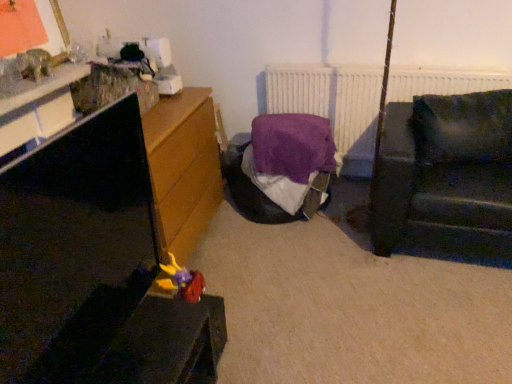
Consider the image. What is the approximate width of matt black tv stand at left?

matt black tv stand at left is 2.69 inches in width.

What do you see at coordinates (106, 254) in the screenshot?
I see `matt black tv stand at left` at bounding box center [106, 254].

Image resolution: width=512 pixels, height=384 pixels. Describe the element at coordinates (331, 100) in the screenshot. I see `white matte radiator at upper center` at that location.

The height and width of the screenshot is (384, 512). What do you see at coordinates (283, 168) in the screenshot?
I see `purple fabric bed at center` at bounding box center [283, 168].

The image size is (512, 384). I want to click on dark green fabric couch at right, so click(x=445, y=174).

Based on the photo, between plush yellow and purple toy at lower left and white matte radiator at upper center, which one has more height?

Standing taller between the two is white matte radiator at upper center.

Is plush yellow and purple toy at lower left not inside white matte radiator at upper center?

Indeed, plush yellow and purple toy at lower left is completely outside white matte radiator at upper center.

Is plush yellow and purple toy at lower left thinner than white matte radiator at upper center?

Incorrect, the width of plush yellow and purple toy at lower left is not less than that of white matte radiator at upper center.

Considering the positions of objects plush yellow and purple toy at lower left and white matte radiator at upper center in the image provided, who is more to the left, plush yellow and purple toy at lower left or white matte radiator at upper center?

From the viewer's perspective, plush yellow and purple toy at lower left appears more on the left side.

From the image's perspective, is matt black tv stand at left located above or below dark green fabric couch at right?

From the image's perspective, matt black tv stand at left appears below dark green fabric couch at right.

Can you confirm if matt black tv stand at left is positioned to the left of dark green fabric couch at right?

Indeed, matt black tv stand at left is positioned on the left side of dark green fabric couch at right.

Which of these two, matt black tv stand at left or dark green fabric couch at right, is thinner?

matt black tv stand at left is thinner.

Is matt black tv stand at left situated inside dark green fabric couch at right or outside?

matt black tv stand at left is located beyond the bounds of dark green fabric couch at right.

Which point is more distant from viewer, (186, 278) or (253, 173)?

The point (253, 173) is more distant.

From a real-world perspective, is plush yellow and purple toy at lower left physically located above or below purple fabric bed at center?

From a real-world perspective, plush yellow and purple toy at lower left is physically above purple fabric bed at center.

Which of these two, plush yellow and purple toy at lower left or purple fabric bed at center, is wider?

purple fabric bed at center is wider.

From their relative heights in the image, would you say matt black tv stand at left is taller or shorter than plush yellow and purple toy at lower left?

matt black tv stand at left is taller than plush yellow and purple toy at lower left.

Is matt black tv stand at left positioned with its back to plush yellow and purple toy at lower left?

No, matt black tv stand at left's orientation is not away from plush yellow and purple toy at lower left.

Which is behind, matt black tv stand at left or plush yellow and purple toy at lower left?

plush yellow and purple toy at lower left is behind.

What's the angular difference between matt black tv stand at left and plush yellow and purple toy at lower left's facing directions?

There is a 1.14-degree angle between the facing directions of matt black tv stand at left and plush yellow and purple toy at lower left.

Considering their positions, is white matte radiator at upper center located in front of or behind plush yellow and purple toy at lower left?

white matte radiator at upper center is positioned farther from the viewer than plush yellow and purple toy at lower left.

Is white matte radiator at upper center oriented away from plush yellow and purple toy at lower left?

No, white matte radiator at upper center is not facing away from plush yellow and purple toy at lower left.

Does white matte radiator at upper center touch plush yellow and purple toy at lower left?

No, white matte radiator at upper center is not beside plush yellow and purple toy at lower left.

From the image's perspective, which is above, white matte radiator at upper center or plush yellow and purple toy at lower left?

white matte radiator at upper center.

From a real-world perspective, relative to dark green fabric couch at right, is plush yellow and purple toy at lower left vertically above or below?

plush yellow and purple toy at lower left is below dark green fabric couch at right.

Is plush yellow and purple toy at lower left inside the boundaries of dark green fabric couch at right, or outside?

plush yellow and purple toy at lower left is not enclosed by dark green fabric couch at right.

Is plush yellow and purple toy at lower left taller or shorter than dark green fabric couch at right?

plush yellow and purple toy at lower left is shorter than dark green fabric couch at right.

Which object is further away from the camera, plush yellow and purple toy at lower left or dark green fabric couch at right?

dark green fabric couch at right is more distant.

Could you tell me if white matte radiator at upper center is turned towards purple fabric bed at center?

Yes, white matte radiator at upper center faces towards purple fabric bed at center.

What's the angular difference between white matte radiator at upper center and purple fabric bed at center's facing directions?

They differ by 0.405 degrees in their facing directions.

How distant is white matte radiator at upper center from purple fabric bed at center?

A distance of 47.74 centimeters exists between white matte radiator at upper center and purple fabric bed at center.

In terms of height, does white matte radiator at upper center look taller or shorter compared to purple fabric bed at center?

white matte radiator at upper center is taller than purple fabric bed at center.

You are a GUI agent. You are given a task and a screenshot of the screen. Output one action in this format:
    pyautogui.click(x=<x>, y=<y>)
    Task: Click on the toy that is under the white matte radiator at upper center (from a real-world perspective)
    Image resolution: width=512 pixels, height=384 pixels.
    Given the screenshot: What is the action you would take?
    pyautogui.click(x=181, y=281)

This screenshot has height=384, width=512. What are the coordinates of `studio couch that is on the right side of matt black tv stand at left` in the screenshot? It's located at (445, 174).

In the scene shown: Which object lies further to the anchor point white matte radiator at upper center, purple fabric bed at center or matt black tv stand at left?

matt black tv stand at left is positioned further to the anchor white matte radiator at upper center.

Looking at the image, which one is located further to purple fabric bed at center, dark green fabric couch at right or white matte radiator at upper center?

dark green fabric couch at right is positioned further to the anchor purple fabric bed at center.

Which object lies nearer to the anchor point dark green fabric couch at right, white matte radiator at upper center or purple fabric bed at center?

The object closer to dark green fabric couch at right is white matte radiator at upper center.

Looking at the image, which one is located closer to matt black tv stand at left, white matte radiator at upper center or plush yellow and purple toy at lower left?

Among the two, plush yellow and purple toy at lower left is located nearer to matt black tv stand at left.

Which object lies nearer to the anchor point dark green fabric couch at right, matt black tv stand at left or plush yellow and purple toy at lower left?

Among the two, plush yellow and purple toy at lower left is located nearer to dark green fabric couch at right.

Considering their positions, is dark green fabric couch at right positioned closer to white matte radiator at upper center than purple fabric bed at center?

purple fabric bed at center is positioned closer to the anchor white matte radiator at upper center.

Considering their positions, is purple fabric bed at center positioned further to dark green fabric couch at right than plush yellow and purple toy at lower left?

plush yellow and purple toy at lower left is further to dark green fabric couch at right.

When comparing their distances from matt black tv stand at left, does plush yellow and purple toy at lower left or dark green fabric couch at right seem further?

dark green fabric couch at right.

At what (x,y) coordinates should I click in order to perform the action: click on bed between plush yellow and purple toy at lower left and white matte radiator at upper center in the horizontal direction. Please return your answer as a coordinate pair (x, y). This screenshot has height=384, width=512. Looking at the image, I should click on (283, 168).

At what (x,y) coordinates should I click in order to perform the action: click on studio couch positioned between matt black tv stand at left and white matte radiator at upper center from near to far. Please return your answer as a coordinate pair (x, y). The width and height of the screenshot is (512, 384). Looking at the image, I should click on (445, 174).

Where is `radiator between plush yellow and purple toy at lower left and dark green fabric couch at right from left to right`? radiator between plush yellow and purple toy at lower left and dark green fabric couch at right from left to right is located at coordinates (331, 100).

Where is `bed between matt black tv stand at left and white matte radiator at upper center from front to back`? bed between matt black tv stand at left and white matte radiator at upper center from front to back is located at coordinates (283, 168).